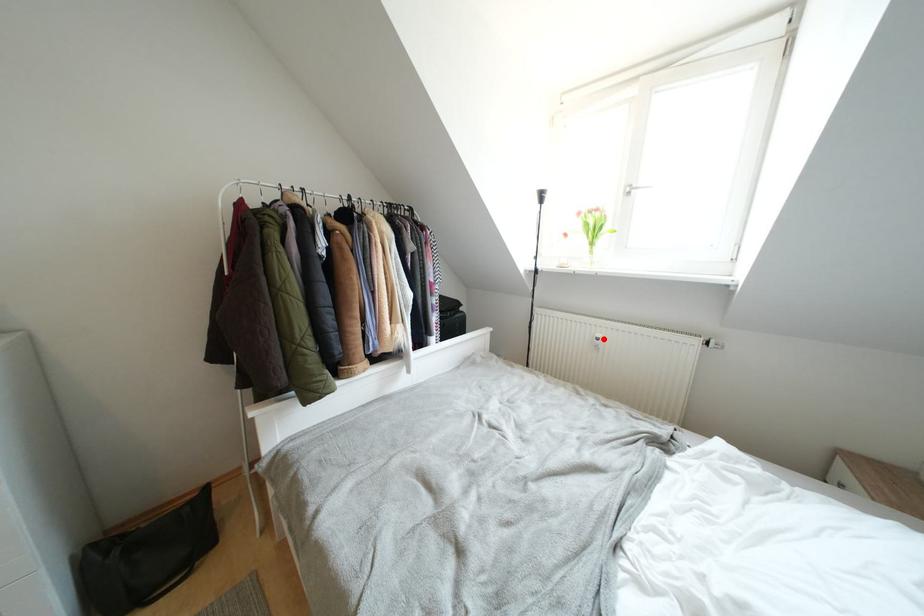
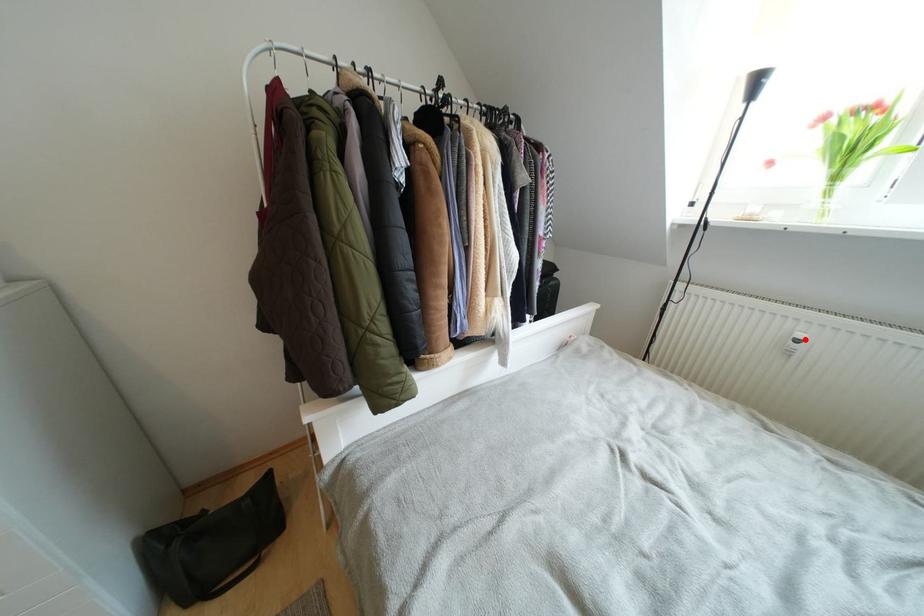
I am providing you with two images of the same scene from different viewpoints. A red point is marked on the first image and another point is marked on the second image. Is the marked point in image1 the same physical position as the marked point in image2?

Yes